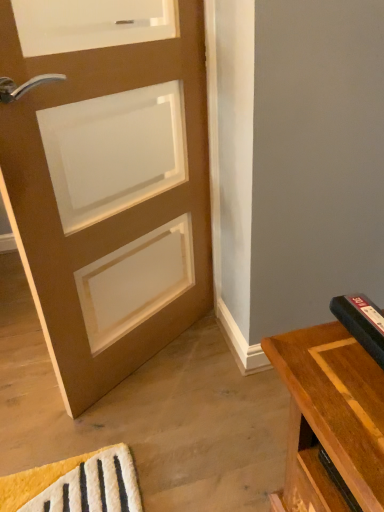
Find the location of `free space in front of matte brown door at left`. free space in front of matte brown door at left is located at coordinates (152, 434).